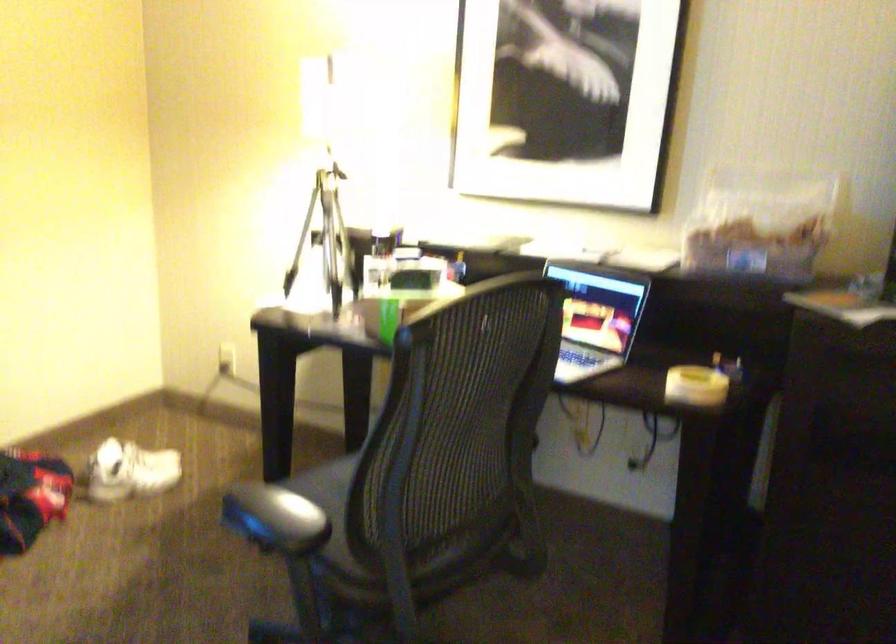
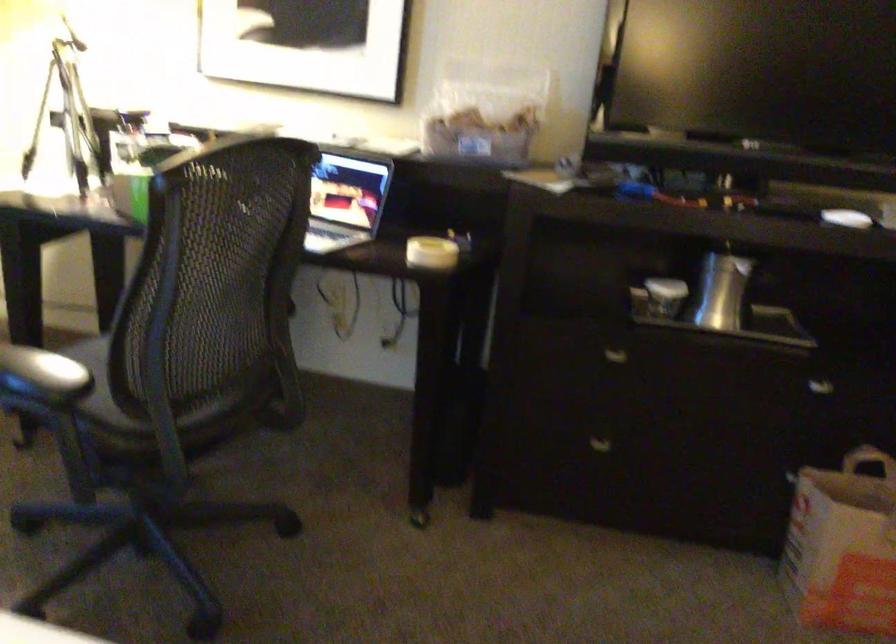
In the second image, find the point that corresponds to (x=359, y=489) in the first image.

(124, 346)